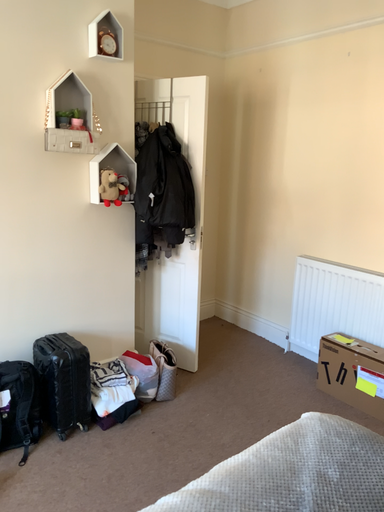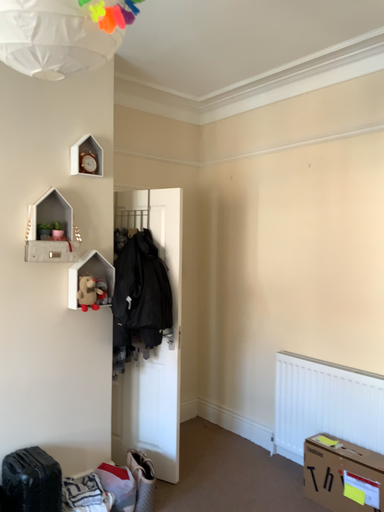
Question: How did the camera likely rotate when shooting the video?

Choices:
 (A) rotated upward
 (B) rotated downward

Answer: (A)